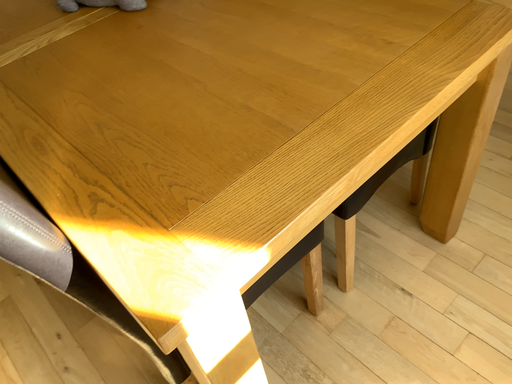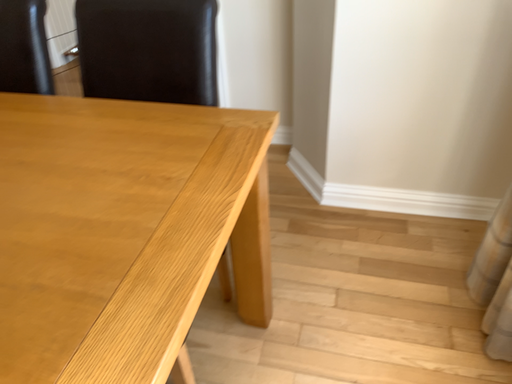
Question: Which way did the camera rotate in the video?

Choices:
 (A) rotated left
 (B) rotated right

Answer: (B)